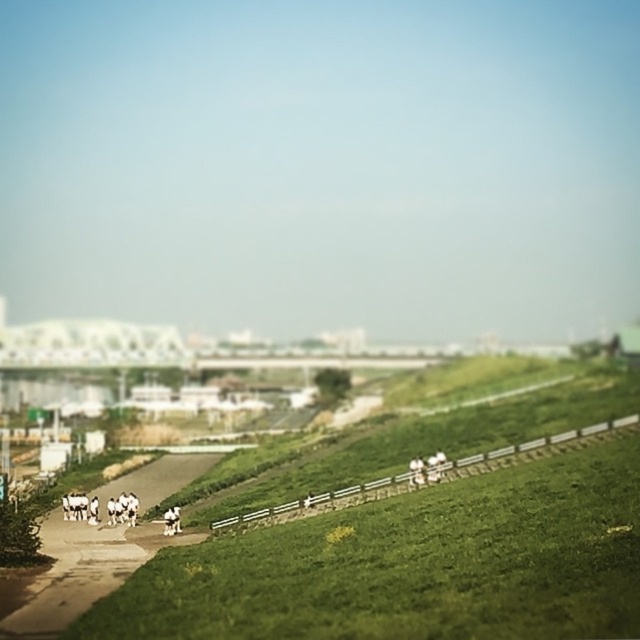
Locate an element on the screen. This screenshot has width=640, height=640. white fluffy dog at lower left is located at coordinates (74, 506).

Can you confirm if white fluffy dog at lower left is wider than white fur horse at lower left?

Correct, the width of white fluffy dog at lower left exceeds that of white fur horse at lower left.

I want to click on white fluffy dog at lower left, so click(74, 506).